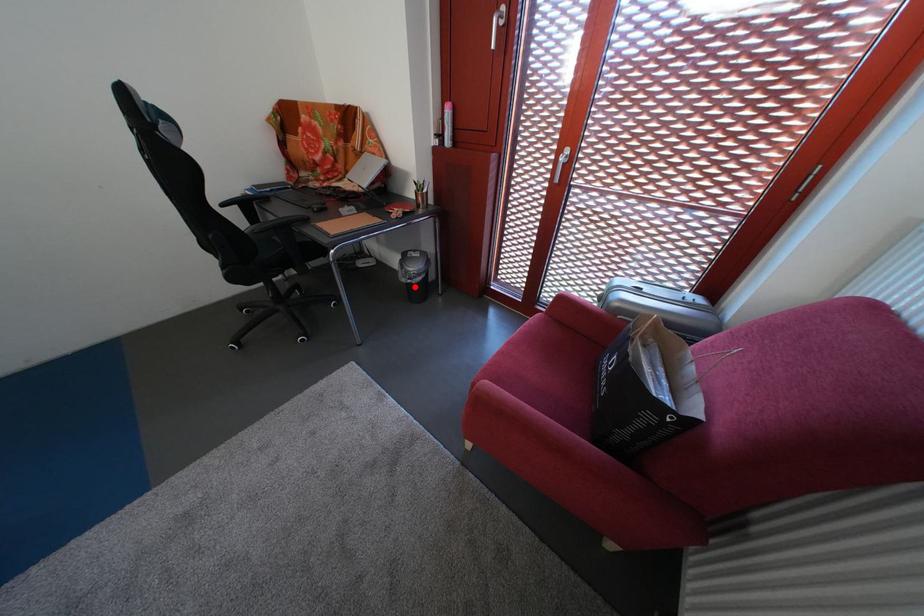
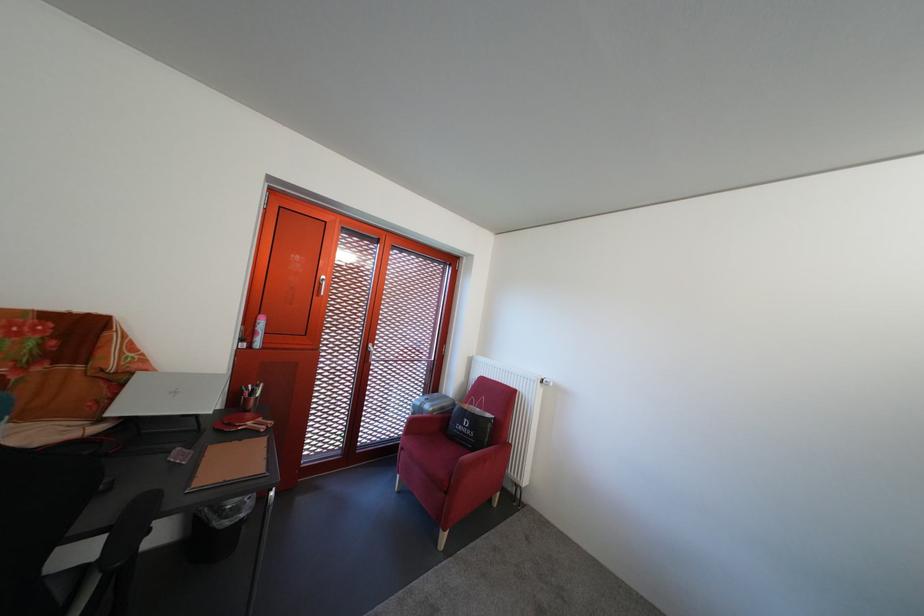
In the second image, find the point that corresponds to the highlighted location in the first image.

(237, 530)